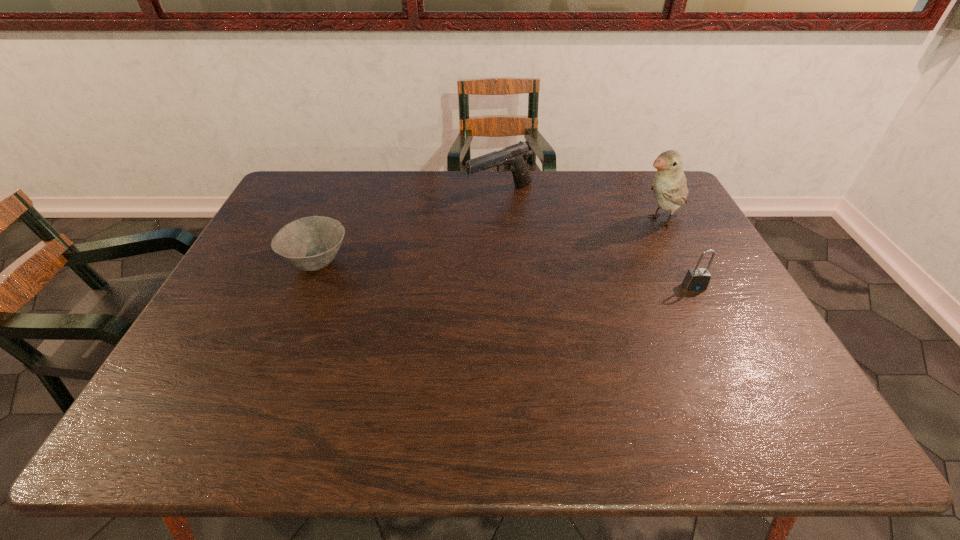
Find the location of a particular element. The height and width of the screenshot is (540, 960). vacant space at the near edge of the desktop is located at coordinates pyautogui.click(x=275, y=381).

Find the location of a particular element. vacant region at the right edge of the desktop is located at coordinates (689, 268).

The height and width of the screenshot is (540, 960). I want to click on vacant position at the far left corner of the desktop, so click(x=324, y=191).

In order to click on vacant space at the far right corner in this screenshot , I will do `click(643, 188)`.

Image resolution: width=960 pixels, height=540 pixels. Find the location of `vacant region between the leftmost object and the padlock`. vacant region between the leftmost object and the padlock is located at coordinates (506, 274).

Find the location of `free space between the padlock and the leftmost object`. free space between the padlock and the leftmost object is located at coordinates (506, 274).

Identify the location of vacant space in between the shortest object and the second farthest object. (488, 241).

Identify the location of free space between the bird and the third shortest object. (580, 207).

Locate an element on the screen. This screenshot has width=960, height=540. free space between the leftmost object and the third object from right to left is located at coordinates [x=409, y=228].

This screenshot has height=540, width=960. In order to click on free point between the tallest object and the leftmost object in this screenshot , I will do `click(488, 241)`.